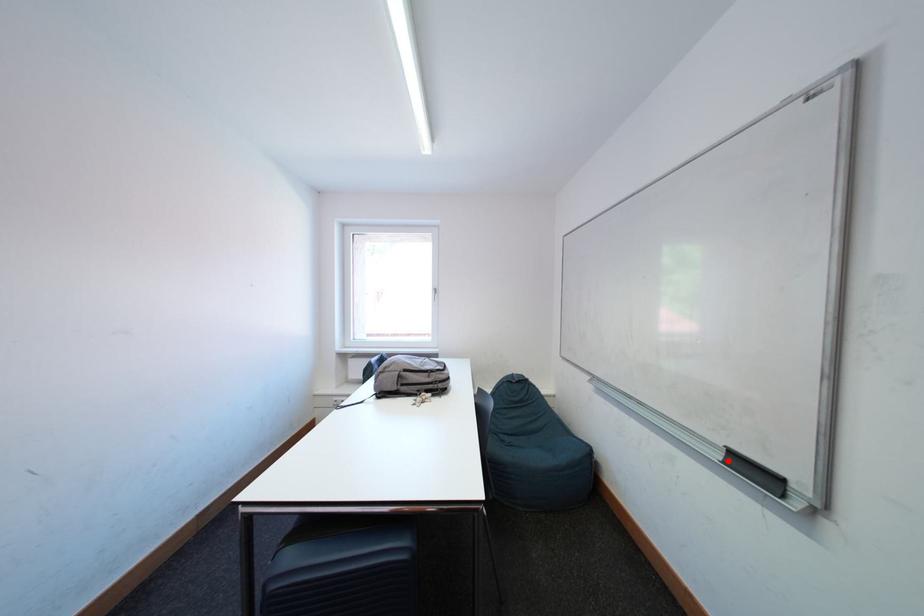
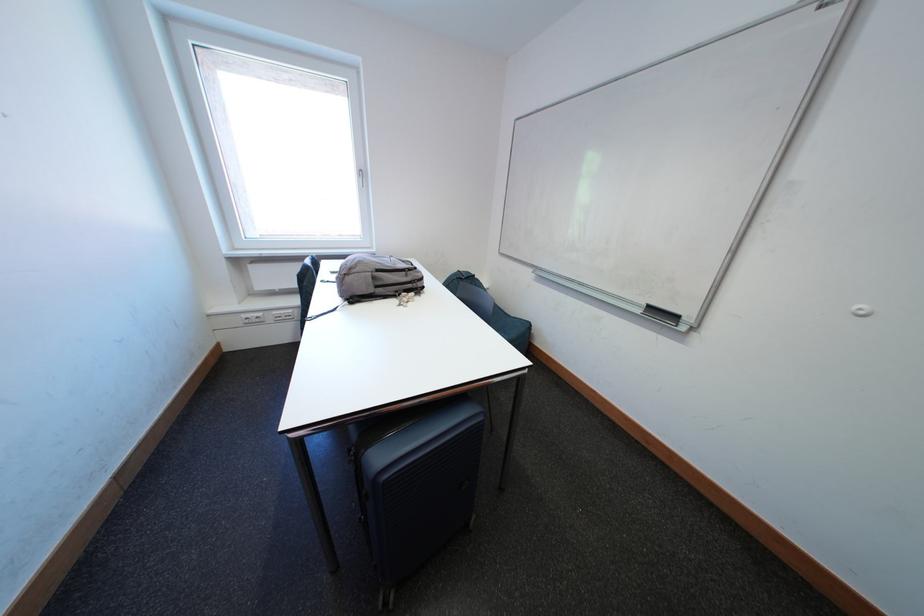
In the second image, find the point that corresponds to the highlighted location in the first image.

(649, 315)